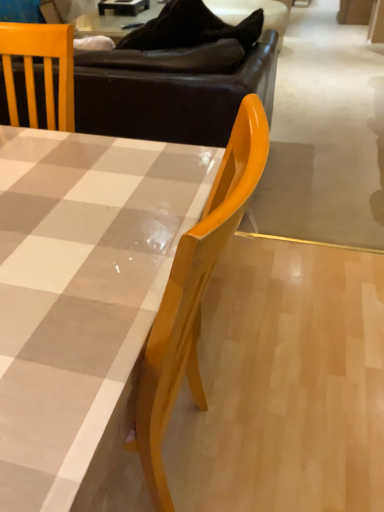
Question: From the image's perspective, is matte checkered table at center below brown leather couch at upper center?

Choices:
 (A) no
 (B) yes

Answer: (B)

Question: From a real-world perspective, is matte checkered table at center located beneath brown leather couch at upper center?

Choices:
 (A) no
 (B) yes

Answer: (B)

Question: Is matte checkered table at center facing towards brown leather couch at upper center?

Choices:
 (A) yes
 (B) no

Answer: (B)

Question: From the image's perspective, is matte checkered table at center located above brown leather couch at upper center?

Choices:
 (A) no
 (B) yes

Answer: (A)

Question: Is matte checkered table at center thinner than brown leather couch at upper center?

Choices:
 (A) no
 (B) yes

Answer: (B)

Question: Can you confirm if matte checkered table at center is positioned to the left of brown leather couch at upper center?

Choices:
 (A) yes
 (B) no

Answer: (A)

Question: From the image's perspective, is brown leather couch at upper center under matte checkered table at center?

Choices:
 (A) no
 (B) yes

Answer: (A)

Question: Can you confirm if brown leather couch at upper center is bigger than matte checkered table at center?

Choices:
 (A) yes
 (B) no

Answer: (A)

Question: From a real-world perspective, is brown leather couch at upper center below matte checkered table at center?

Choices:
 (A) no
 (B) yes

Answer: (A)

Question: Is matte checkered table at center a part of brown leather couch at upper center?

Choices:
 (A) yes
 (B) no

Answer: (B)

Question: Does brown leather couch at upper center have a greater height compared to matte checkered table at center?

Choices:
 (A) no
 (B) yes

Answer: (B)

Question: Is brown leather couch at upper center at the left side of matte checkered table at center?

Choices:
 (A) no
 (B) yes

Answer: (A)

Question: In terms of width, does matte checkered table at center look wider or thinner when compared to brown leather couch at upper center?

Choices:
 (A) wide
 (B) thin

Answer: (B)